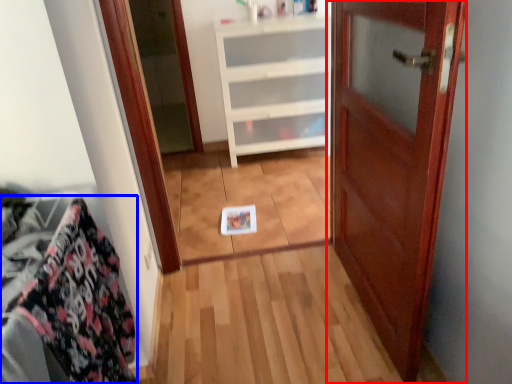
Question: Which object appears closest to the camera in this image, door (highlighted by a red box) or material (highlighted by a blue box)?

Choices:
 (A) door
 (B) material

Answer: (B)